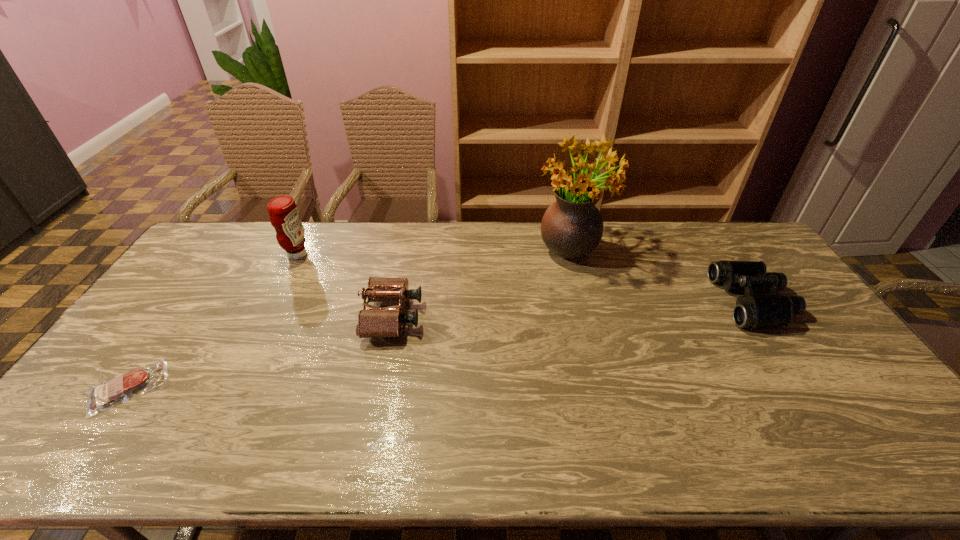
This screenshot has height=540, width=960. I want to click on flower arrangement, so click(572, 227).

Locate an element on the screen. The height and width of the screenshot is (540, 960). the second object from right to left is located at coordinates (572, 227).

This screenshot has height=540, width=960. What are the coordinates of `condiment` in the screenshot? It's located at (284, 216).

This screenshot has height=540, width=960. Identify the location of the second object from left to right. (284, 216).

Identify the location of the left binoculars. (386, 322).

Where is `the rightmost object`? This screenshot has height=540, width=960. the rightmost object is located at coordinates (752, 311).

At what (x,y) coordinates should I click in order to perform the action: click on steak. Please return your answer as a coordinate pair (x, y). Image resolution: width=960 pixels, height=540 pixels. Looking at the image, I should click on (102, 396).

This screenshot has width=960, height=540. Identify the location of the shortest object. (102, 396).

Find the location of a particular element. This screenshot has width=960, height=540. vacant space located 0.130m on the left of the flower arrangement is located at coordinates (497, 247).

Locate an element on the screen. The height and width of the screenshot is (540, 960). vacant space located 0.130m on the back of the condiment is located at coordinates (312, 225).